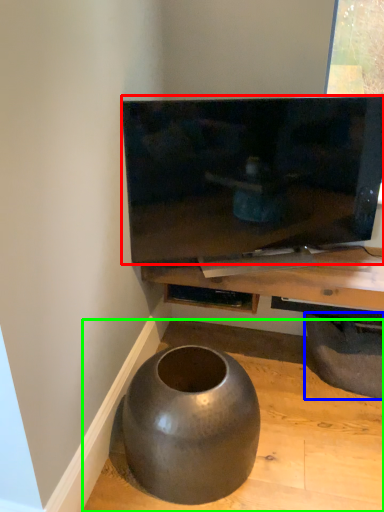
Question: Estimate the real-world distances between objects in this image. Which object is farther from television (highlighted by a red box), tire (highlighted by a blue box) or concrete (highlighted by a green box)?

Choices:
 (A) tire
 (B) concrete

Answer: (B)